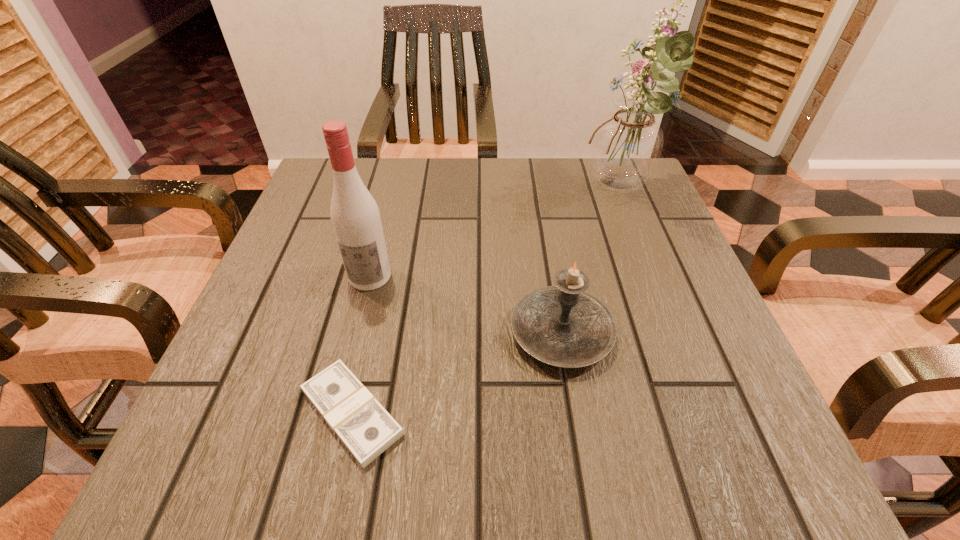
The height and width of the screenshot is (540, 960). Find the location of `the rightmost object`. the rightmost object is located at coordinates (626, 146).

You are a GUI agent. You are given a task and a screenshot of the screen. Output one action in this format:
    pyautogui.click(x=<x>, y=<y>)
    Task: Click on the farthest object
    Image resolution: width=960 pixels, height=540 pixels.
    Given the screenshot: What is the action you would take?
    pyautogui.click(x=626, y=146)

Where is `alcohol`? The height and width of the screenshot is (540, 960). alcohol is located at coordinates (x=356, y=220).

At what (x,y) coordinates should I click in order to perform the action: click on the third shortest object. Please return your answer as a coordinate pair (x, y). Looking at the image, I should click on coord(356,220).

Find the location of a particular element. This screenshot has height=540, width=960. candle is located at coordinates (564, 326).

Find the location of a particular element. the second shortest object is located at coordinates (564, 326).

At what (x,y) coordinates should I click in order to perform the action: click on dollar. Please return your answer as a coordinate pair (x, y). Looking at the image, I should click on (363, 425).

Find the location of a particular element. vacant space located 0.110m on the front-facing side of the bouquet is located at coordinates (535, 192).

You are a GUI agent. You are given a task and a screenshot of the screen. Output one action in this format:
    pyautogui.click(x=<x>, y=<y>)
    Task: Click on the vacant space positioned on the front-facing side of the bouquet
    The height and width of the screenshot is (540, 960).
    Given the screenshot: What is the action you would take?
    pyautogui.click(x=430, y=192)

I want to click on vacant space located on the front-facing side of the bouquet, so click(547, 192).